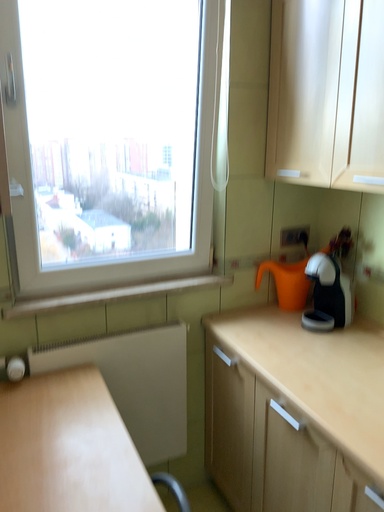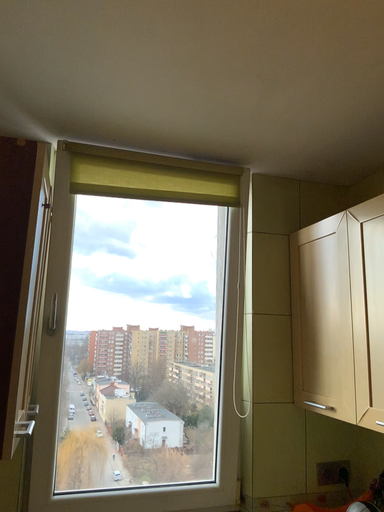
Question: How did the camera likely rotate when shooting the video?

Choices:
 (A) rotated downward
 (B) rotated upward

Answer: (B)